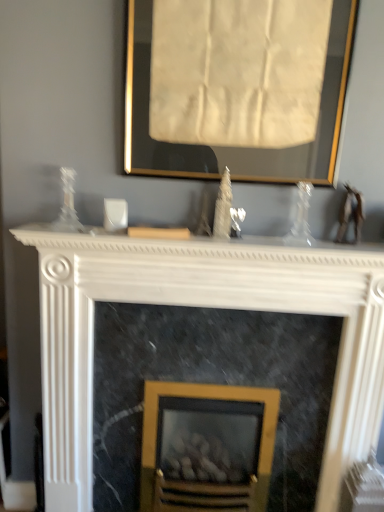
What is the approximate height of white marble fireplace at center?

white marble fireplace at center is 3.39 inches tall.

Identify the location of gold-framed artwork at upper center. This screenshot has height=512, width=384. (236, 147).

I want to click on white marble fireplace at center, so click(x=203, y=247).

The width and height of the screenshot is (384, 512). Identify the location of picture frame that appears on the right of white marble fireplace at center. tap(236, 147).

Considering the sizes of objects white marble fireplace at center and gold-framed artwork at upper center in the image provided, who is shorter, white marble fireplace at center or gold-framed artwork at upper center?

white marble fireplace at center is shorter.

Which object is closer to the camera, white marble fireplace at center or gold-framed artwork at upper center?

gold-framed artwork at upper center is closer to the camera.

Considering the positions of point (131, 239) and point (327, 121), is point (131, 239) closer or farther from the camera than point (327, 121)?

Point (131, 239) is closer to the camera than point (327, 121).

Could you measure the distance between white marble fireplace at center, the 3th fireplace in the back-to-front sequence, and marble fireplace at center, marked as the 2th fireplace in a back-to-front arrangement?

A distance of 5.44 inches exists between white marble fireplace at center, the 3th fireplace in the back-to-front sequence, and marble fireplace at center, marked as the 2th fireplace in a back-to-front arrangement.

From a real-world perspective, between white marble fireplace at center, the 3th fireplace in the back-to-front sequence, and marble fireplace at center, marked as the 2th fireplace in a back-to-front arrangement, who is vertically lower?

From a 3D spatial view, marble fireplace at center, marked as the 2th fireplace in a back-to-front arrangement, is below.

Based on the photo, considering the sizes of objects white marble fireplace at center, which is counted as the 1th fireplace, starting from the front, and marble fireplace at center, acting as the second fireplace starting from the front, in the image provided, who is wider, white marble fireplace at center, which is counted as the 1th fireplace, starting from the front, or marble fireplace at center, acting as the second fireplace starting from the front,?

white marble fireplace at center, which is counted as the 1th fireplace, starting from the front, is wider.

Is white marble fireplace at center, which is counted as the 1th fireplace, starting from the front, smaller than marble fireplace at center, acting as the second fireplace starting from the front?

Incorrect, white marble fireplace at center, which is counted as the 1th fireplace, starting from the front, is not smaller in size than marble fireplace at center, acting as the second fireplace starting from the front.

Which of these two, white marble fireplace at center, the 3th fireplace in the back-to-front sequence, or white marble fireplace at center, is wider?

white marble fireplace at center is wider.

How different are the orientations of white marble fireplace at center, which is counted as the 1th fireplace, starting from the front, and white marble fireplace at center in degrees?

The facing directions of white marble fireplace at center, which is counted as the 1th fireplace, starting from the front, and white marble fireplace at center are 1 degrees apart.

Visually, is white marble fireplace at center, the 3th fireplace in the back-to-front sequence, positioned to the left or to the right of white marble fireplace at center?

Based on their positions, white marble fireplace at center, the 3th fireplace in the back-to-front sequence, is located to the right of white marble fireplace at center.

Considering the sizes of objects white marble fireplace at center, the 3th fireplace in the back-to-front sequence, and white marble fireplace at center in the image provided, who is bigger, white marble fireplace at center, the 3th fireplace in the back-to-front sequence, or white marble fireplace at center?

With larger size is white marble fireplace at center, the 3th fireplace in the back-to-front sequence.

Is white marble fireplace at center looking in the opposite direction of white marble fireplace at center, the 3th fireplace in the back-to-front sequence?

white marble fireplace at center does not have its back to white marble fireplace at center, the 3th fireplace in the back-to-front sequence.

Is white marble fireplace at center, the 3th fireplace in the back-to-front sequence, located within white marble fireplace at center?

No, white marble fireplace at center, the 3th fireplace in the back-to-front sequence, is located outside of white marble fireplace at center.

Which is nearer, (287, 250) or (367, 311)?

Point (287, 250) appears to be closer to the viewer than point (367, 311).

From the image's perspective, which is below, white marble fireplace at center or white marble fireplace at center, the 3th fireplace in the back-to-front sequence?

white marble fireplace at center, the 3th fireplace in the back-to-front sequence, is shown below in the image.

From the picture: From the image's perspective, is gold-framed artwork at upper center on top of white marble fireplace at center?

Yes.

The width and height of the screenshot is (384, 512). Find the location of `picture frame that appears in front of the white marble fireplace at center`. picture frame that appears in front of the white marble fireplace at center is located at coordinates (236, 147).

Is gold-framed artwork at upper center in front of or behind white marble fireplace at center in the image?

Clearly, gold-framed artwork at upper center is in front of white marble fireplace at center.

Does gold-framed artwork at upper center touch white marble fireplace at center, the 3th fireplace in the back-to-front sequence?

They are not placed beside each other.

Is the depth of gold-framed artwork at upper center less than that of white marble fireplace at center, the 3th fireplace in the back-to-front sequence?

Yes, gold-framed artwork at upper center is closer to the viewer.

Which of these two, gold-framed artwork at upper center or white marble fireplace at center, which is counted as the 1th fireplace, starting from the front, is thinner?

With smaller width is gold-framed artwork at upper center.

From the image's perspective, is gold-framed artwork at upper center over white marble fireplace at center, which is counted as the 1th fireplace, starting from the front?

Indeed, from the image's perspective, gold-framed artwork at upper center is shown above white marble fireplace at center, which is counted as the 1th fireplace, starting from the front.

From a real-world perspective, relative to gold-framed artwork at upper center, is white marble fireplace at center, which is counted as the 1th fireplace, starting from the front, vertically above or below?

In terms of real-world spatial position, white marble fireplace at center, which is counted as the 1th fireplace, starting from the front, is below gold-framed artwork at upper center.

In terms of size, does white marble fireplace at center, which is counted as the 1th fireplace, starting from the front, appear bigger or smaller than gold-framed artwork at upper center?

Considering their sizes, white marble fireplace at center, which is counted as the 1th fireplace, starting from the front, takes up more space than gold-framed artwork at upper center.

Looking at this image, from their relative heights in the image, would you say white marble fireplace at center, the 3th fireplace in the back-to-front sequence, is taller or shorter than gold-framed artwork at upper center?

In the image, white marble fireplace at center, the 3th fireplace in the back-to-front sequence, appears to be taller than gold-framed artwork at upper center.

Identify the location of picture frame that appears above the white marble fireplace at center (from a real-world perspective). The image size is (384, 512). (236, 147).

Identify the location of fireplace in front of the marble fireplace at center, acting as the second fireplace starting from the front. This screenshot has height=512, width=384. (201, 306).

Based on their spatial positions, is marble fireplace at center, acting as the second fireplace starting from the front, or white marble fireplace at center further from white marble fireplace at center, the 3th fireplace in the back-to-front sequence?

Among the two, white marble fireplace at center is located further to white marble fireplace at center, the 3th fireplace in the back-to-front sequence.

Which object lies further to the anchor point marble fireplace at center, marked as the 2th fireplace in a back-to-front arrangement, gold-framed artwork at upper center or gold-framed fireplace at center, acting as the 1th fireplace starting from the back?

Based on the image, gold-framed artwork at upper center appears to be further to marble fireplace at center, marked as the 2th fireplace in a back-to-front arrangement.

Estimate the real-world distances between objects in this image. Which object is closer to marble fireplace at center, marked as the 2th fireplace in a back-to-front arrangement, white marble fireplace at center or gold-framed fireplace at center, which appears as the 3th fireplace when viewed from the front?

gold-framed fireplace at center, which appears as the 3th fireplace when viewed from the front, is positioned closer to the anchor marble fireplace at center, marked as the 2th fireplace in a back-to-front arrangement.

Estimate the real-world distances between objects in this image. Which object is closer to gold-framed artwork at upper center, white marble fireplace at center, which is counted as the 1th fireplace, starting from the front, or gold-framed fireplace at center, which appears as the 3th fireplace when viewed from the front?

The object closer to gold-framed artwork at upper center is white marble fireplace at center, which is counted as the 1th fireplace, starting from the front.

Consider the image. Considering their positions, is marble fireplace at center, marked as the 2th fireplace in a back-to-front arrangement, positioned further to white marble fireplace at center than gold-framed fireplace at center, acting as the 1th fireplace starting from the back?

gold-framed fireplace at center, acting as the 1th fireplace starting from the back, lies further to white marble fireplace at center than the other object.

Considering their positions, is gold-framed artwork at upper center positioned closer to white marble fireplace at center, which is counted as the 1th fireplace, starting from the front, than marble fireplace at center, acting as the second fireplace starting from the front?

Based on the image, marble fireplace at center, acting as the second fireplace starting from the front, appears to be nearer to white marble fireplace at center, which is counted as the 1th fireplace, starting from the front.

Which object lies further to the anchor point white marble fireplace at center, the 3th fireplace in the back-to-front sequence, marble fireplace at center, marked as the 2th fireplace in a back-to-front arrangement, or gold-framed fireplace at center, which appears as the 3th fireplace when viewed from the front?

gold-framed fireplace at center, which appears as the 3th fireplace when viewed from the front, is positioned further to the anchor white marble fireplace at center, the 3th fireplace in the back-to-front sequence.

Estimate the real-world distances between objects in this image. Which object is closer to white marble fireplace at center, which is counted as the 1th fireplace, starting from the front, gold-framed artwork at upper center or gold-framed fireplace at center, which appears as the 3th fireplace when viewed from the front?

gold-framed fireplace at center, which appears as the 3th fireplace when viewed from the front, lies closer to white marble fireplace at center, which is counted as the 1th fireplace, starting from the front, than the other object.

You are a GUI agent. You are given a task and a screenshot of the screen. Output one action in this format:
    pyautogui.click(x=<x>, y=<y>)
    Task: Click on the fireplace between white marble fireplace at center and marble fireplace at center, marked as the 2th fireplace in a back-to-front arrangement, in the up-down direction
    The height and width of the screenshot is (512, 384).
    Given the screenshot: What is the action you would take?
    pyautogui.click(x=201, y=306)

Find the location of a particular element. This screenshot has width=384, height=512. fireplace between gold-framed artwork at upper center and marble fireplace at center, acting as the second fireplace starting from the front, in the vertical direction is located at coordinates (201, 306).

You are a GUI agent. You are given a task and a screenshot of the screen. Output one action in this format:
    pyautogui.click(x=<x>, y=<y>)
    Task: Click on the mantle between gold-framed artwork at upper center and gold-framed fireplace at center, acting as the 1th fireplace starting from the back, in the up-down direction
    This screenshot has height=512, width=384.
    Given the screenshot: What is the action you would take?
    pyautogui.click(x=203, y=247)

The image size is (384, 512). In order to click on mantle that lies between gold-framed artwork at upper center and marble fireplace at center, acting as the second fireplace starting from the front, from top to bottom in this screenshot , I will do `click(203, 247)`.